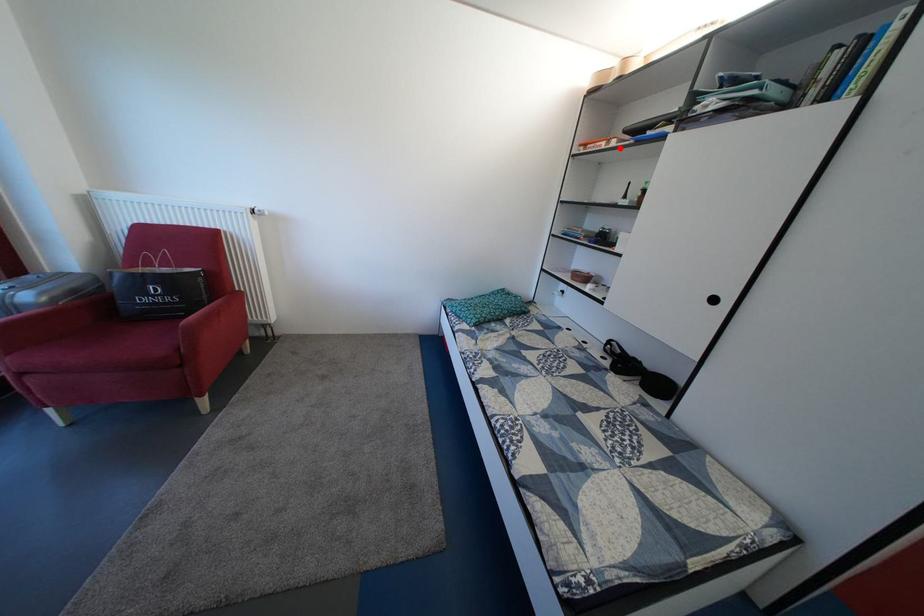
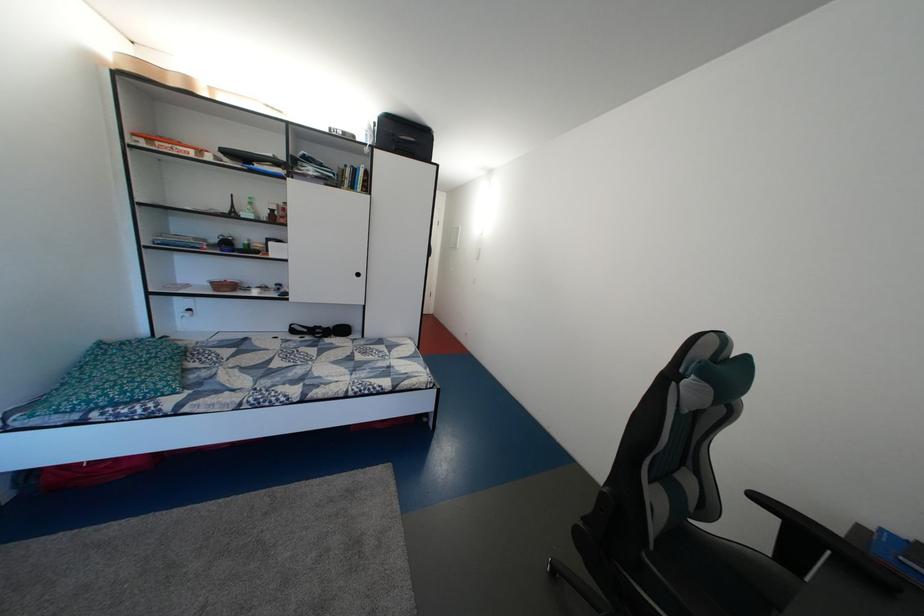
The point at the highlighted location is marked in the first image. Where is the corresponding point in the second image?

(211, 159)